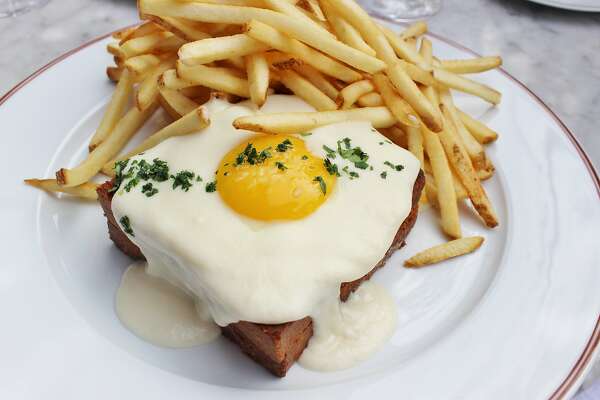
I want to click on edge of white plate, so click(x=578, y=0).